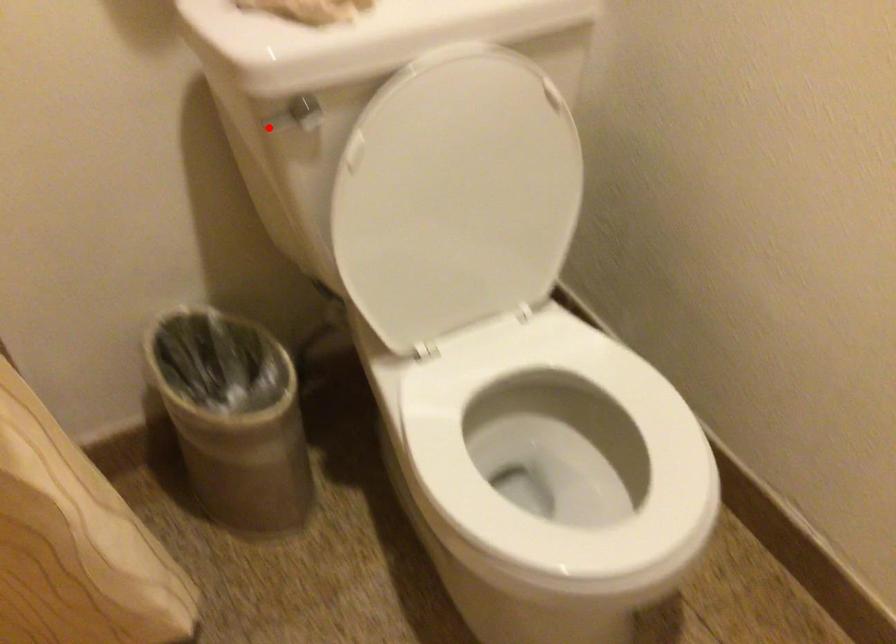
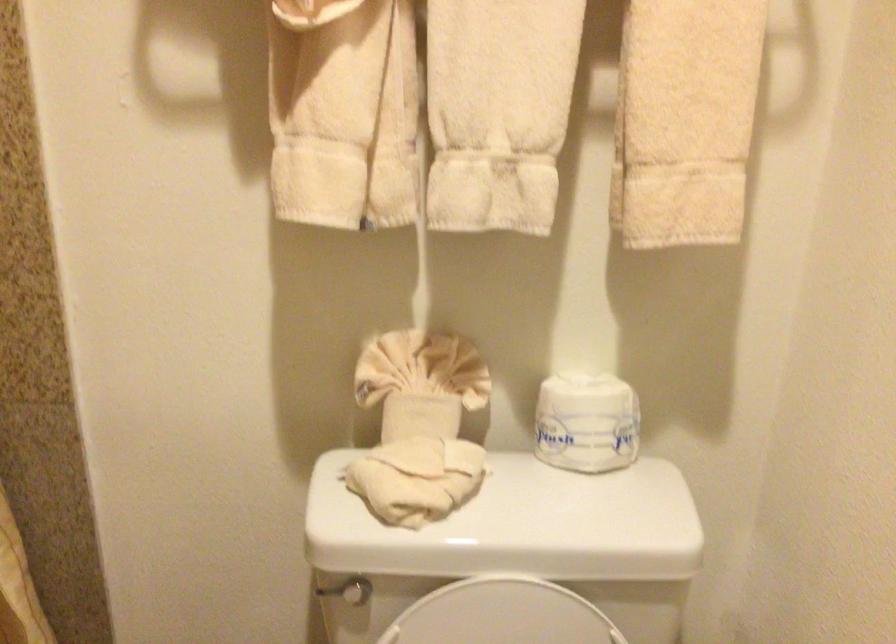
In the second image, find the point that corresponds to the highlighted location in the first image.

(326, 590)